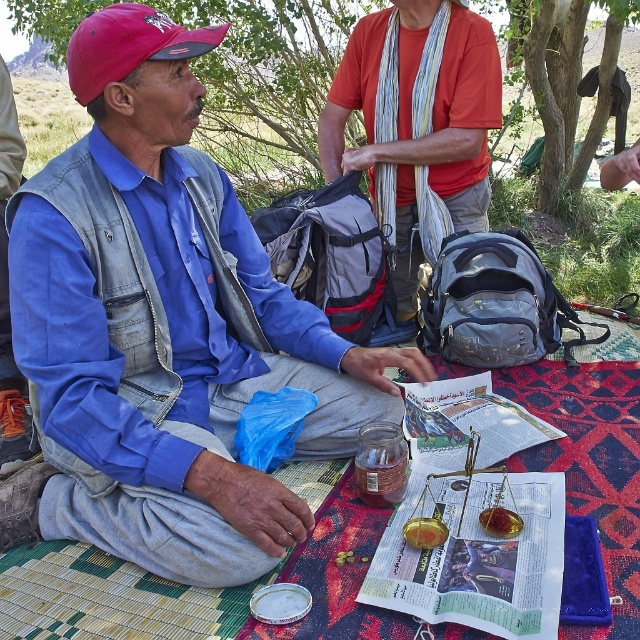
Based on the photo, you are a hiker who needs to place a 36 inch long backpack between the denim vest at left and the orange cotton shirt at center. Can you fit it between them without moving either object?

The denim vest at left and orange cotton shirt at center are 38.64 inches apart from each other, so yes, the 36 inch long backpack can fit between them since the distance is greater than the backpack length.

You are standing in the desert scene and want to walk from point A to point B. Point A is at coordinate (288, 81) and point B is at coordinate (433, 168). Which point is closer to you, and which one is farther away?

Point A at coordinate (288, 81) is closer to you, while point B at coordinate (433, 168) is farther away because the description states that point A is further to the viewer than point B.